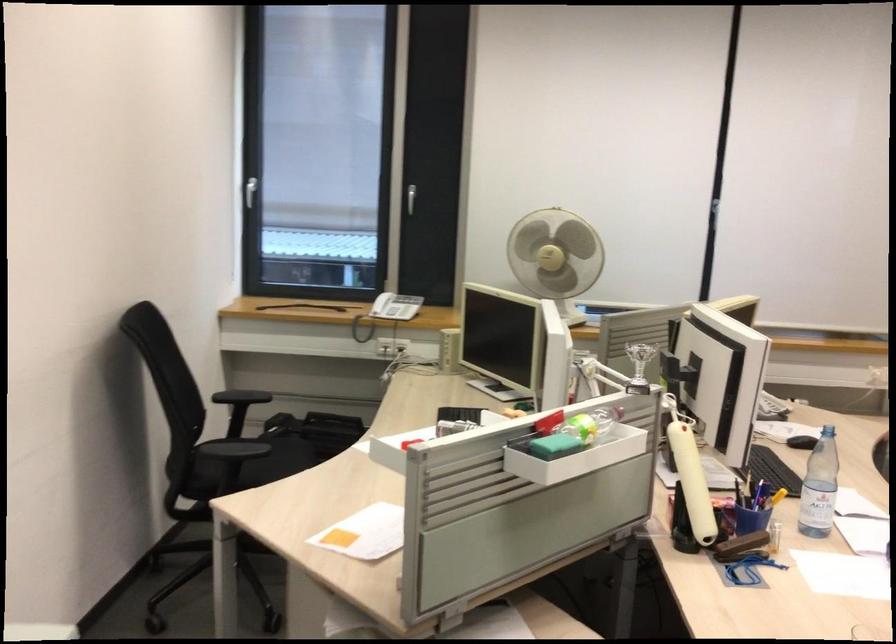
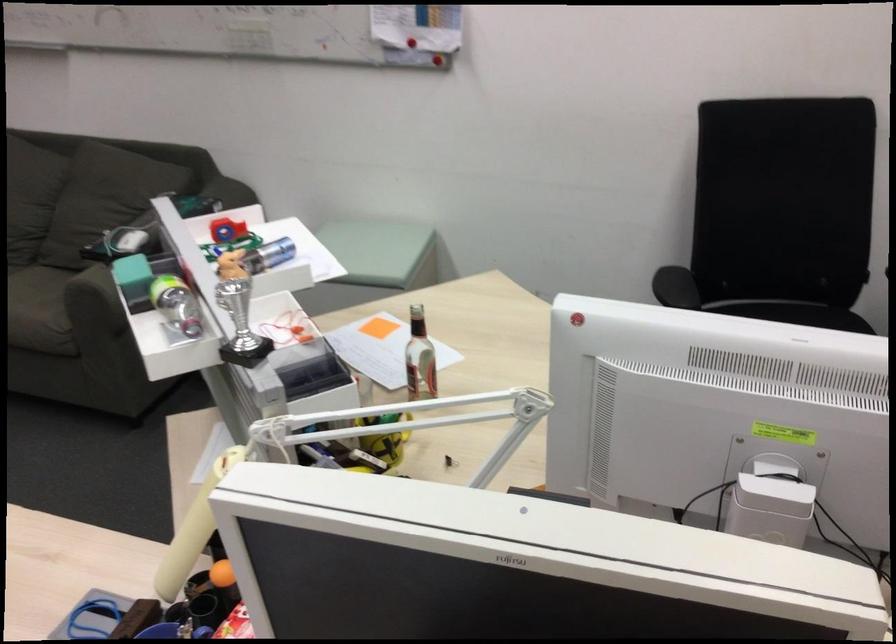
The point at (x=382, y=458) is marked in the first image. Where is the corresponding point in the second image?

(221, 230)